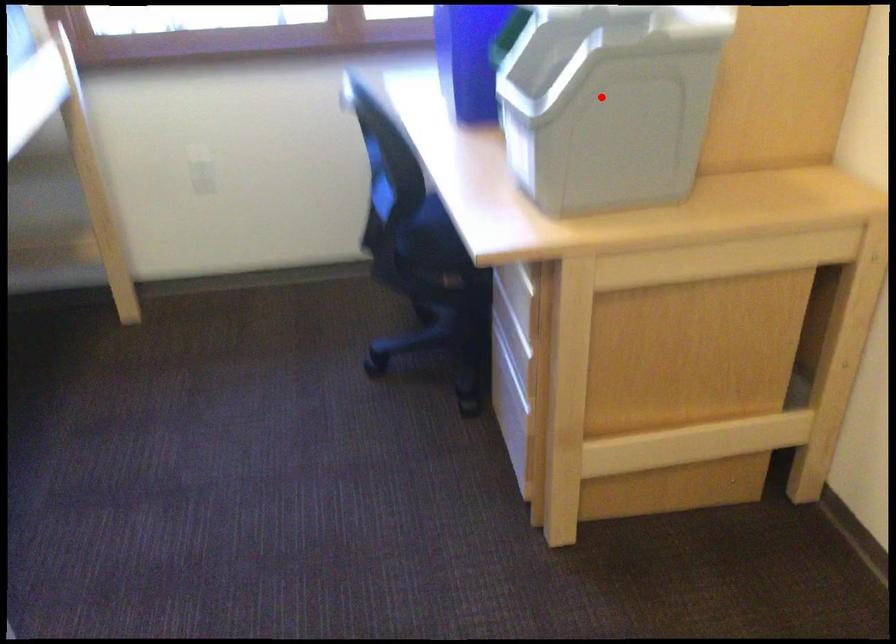
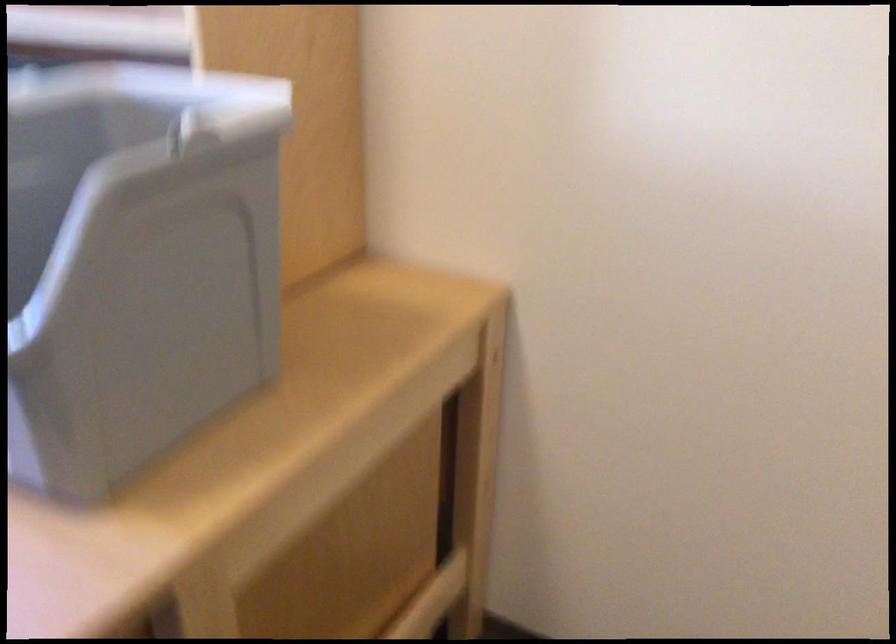
Question: I am providing you with two images of the same scene from different viewpoints. Image1 has a red point marked. In image2, the corresponding 3D location appears at what relative position? Reply with the corresponding letter.

Choices:
 (A) Closer
 (B) Farther

Answer: (A)